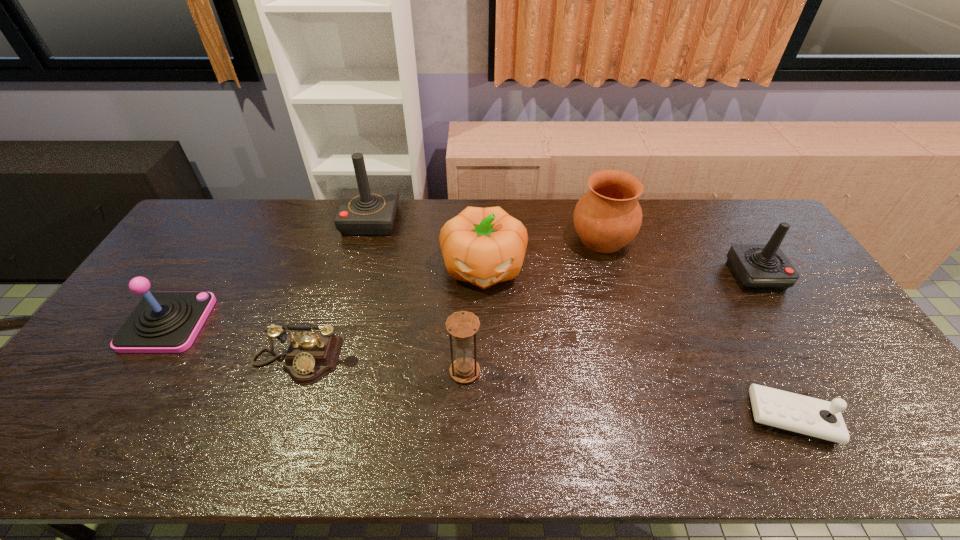
Where is `pottery that is at the far edge`? pottery that is at the far edge is located at coordinates (606, 218).

Find the location of a particular element. pumpkin that is at the far edge is located at coordinates (483, 246).

What are the coordinates of `object present at the near edge` in the screenshot? It's located at (790, 412).

The height and width of the screenshot is (540, 960). Find the location of `object at the left edge`. object at the left edge is located at coordinates (163, 322).

Find the location of `object located at the right edge`. object located at the right edge is located at coordinates (757, 267).

Find the location of a particular element. This screenshot has height=540, width=960. vacant region at the far edge of the desktop is located at coordinates (317, 204).

What are the coordinates of `vacant space at the near edge of the desktop` in the screenshot? It's located at (308, 437).

What are the coordinates of `blank space at the left edge of the desktop` in the screenshot? It's located at (134, 307).

In the image, there is a desktop. Identify the location of vacant space at the right edge. (876, 411).

Find the location of a particular element. This screenshot has height=540, width=960. vacant space at the far left corner of the desktop is located at coordinates (218, 233).